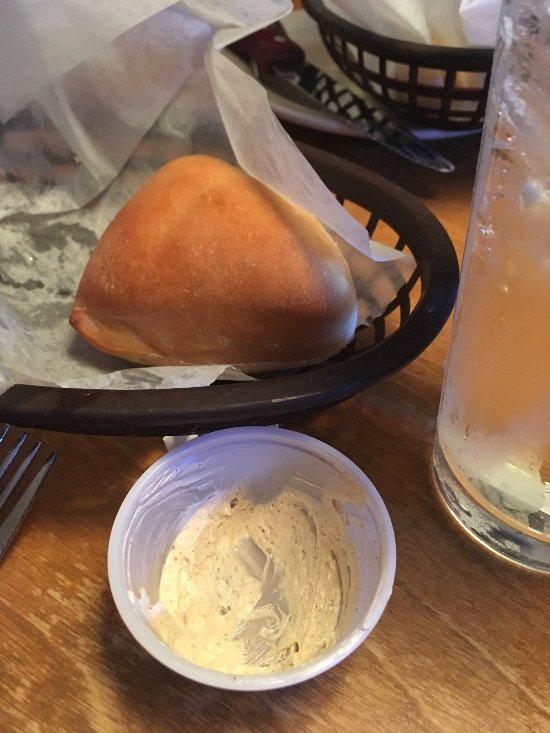
Locate an element on the screen. The image size is (550, 733). basket is located at coordinates (x=447, y=59).